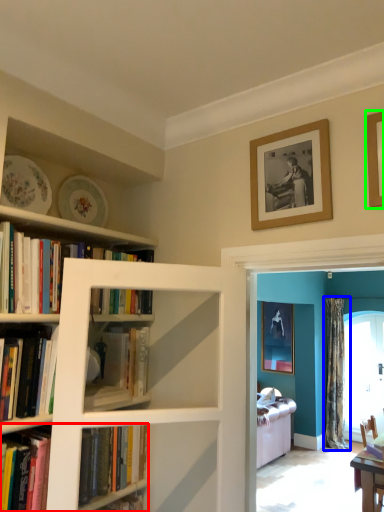
Question: Based on their relative distances, which object is farther from book (highlighted by a red box)? Choose from curtain (highlighted by a blue box) and picture frame (highlighted by a green box).

Choices:
 (A) curtain
 (B) picture frame

Answer: (A)